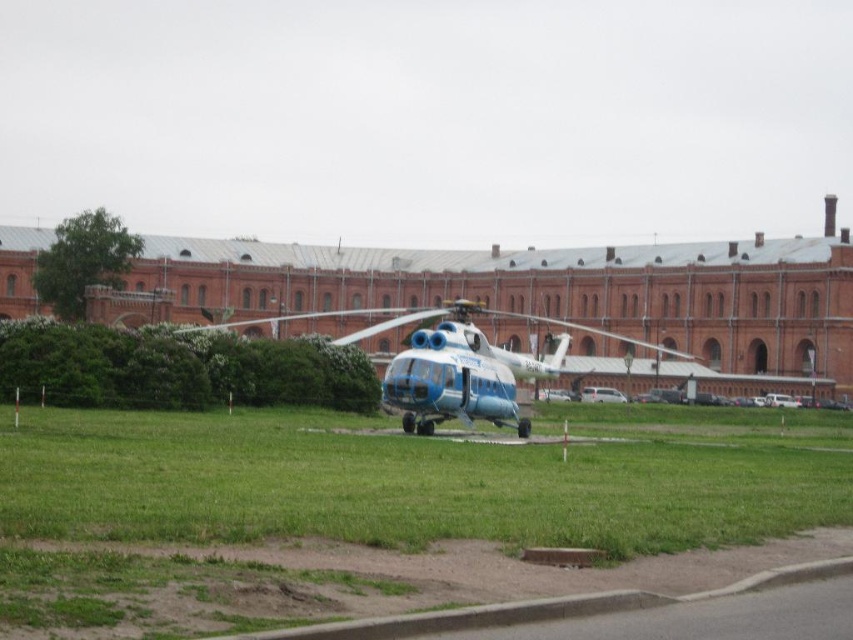
Can you confirm if green grass at center is wider than blue metallic helicopter at center?

In fact, green grass at center might be narrower than blue metallic helicopter at center.

Which is in front, point (112, 460) or point (556, 321)?

Point (112, 460) is in front.

Identify the location of green grass at center. The image size is (853, 640). (397, 483).